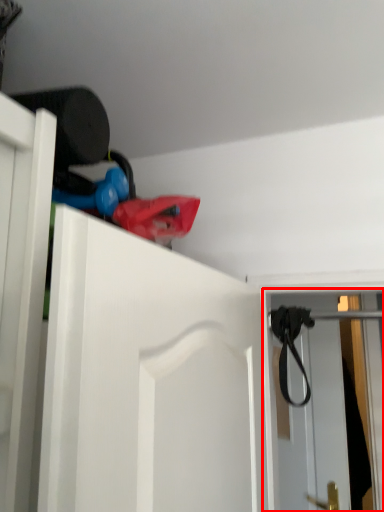
Question: In this image, where is screen door (annotated by the red box) located relative to strap?

Choices:
 (A) right
 (B) left

Answer: (A)